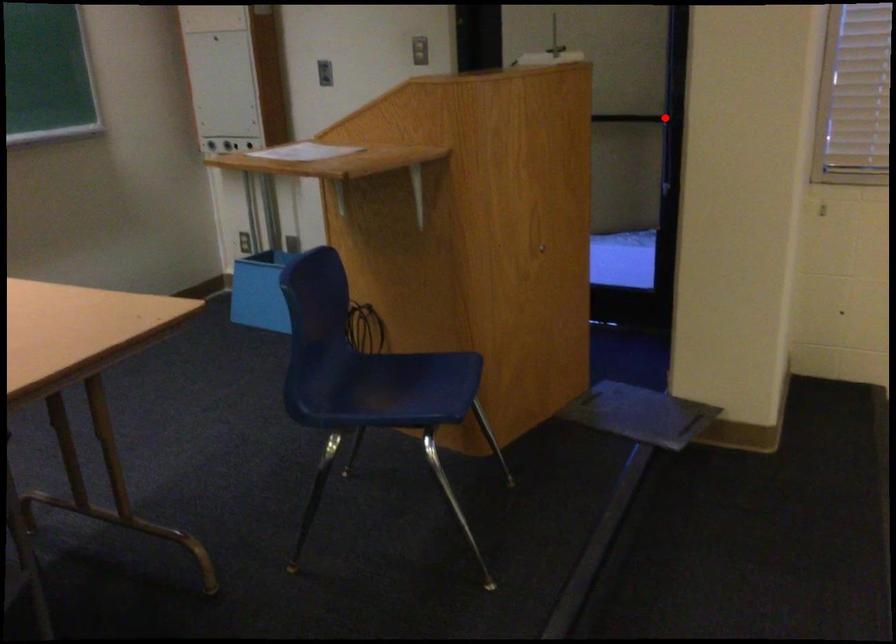
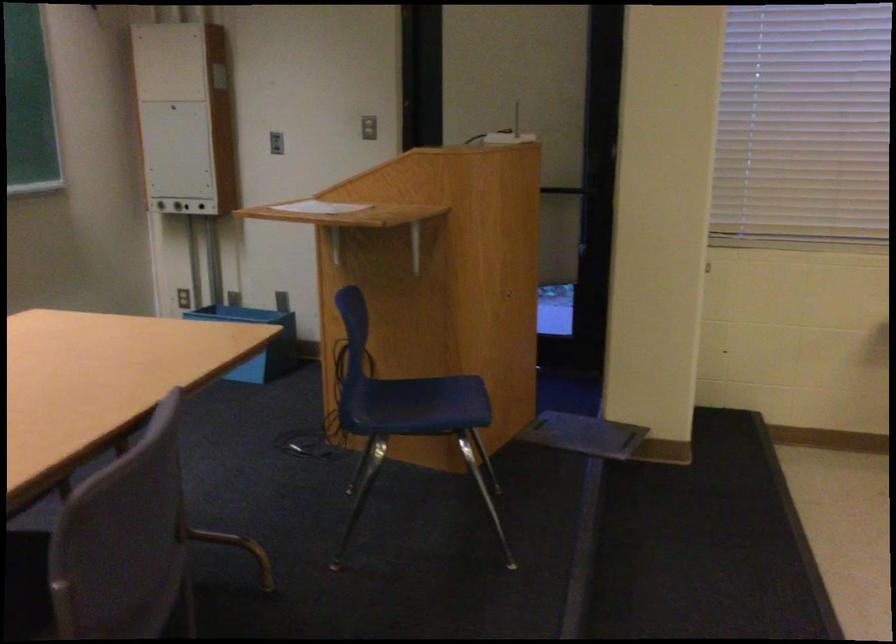
Find the pixel in the second image that matches the highlighted location in the first image.

(583, 189)